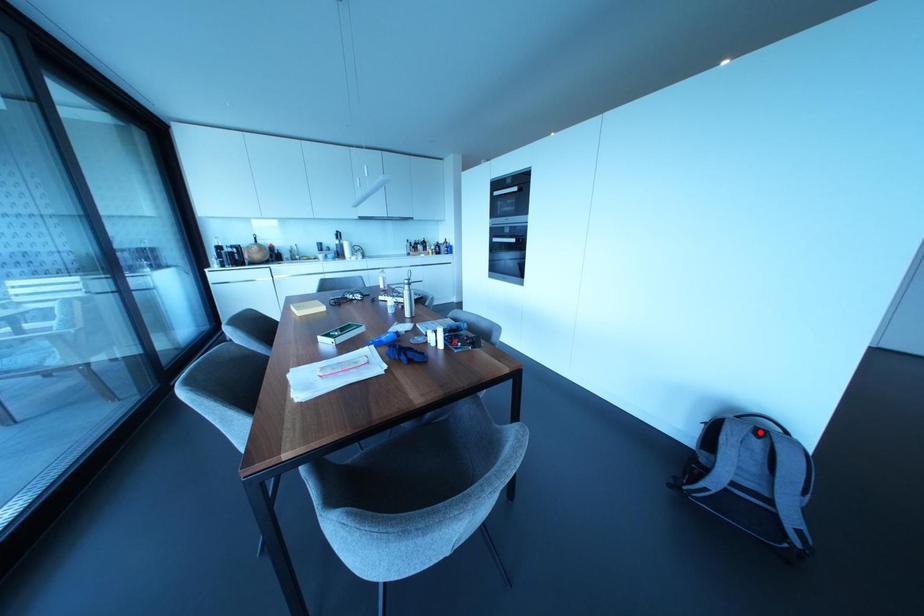
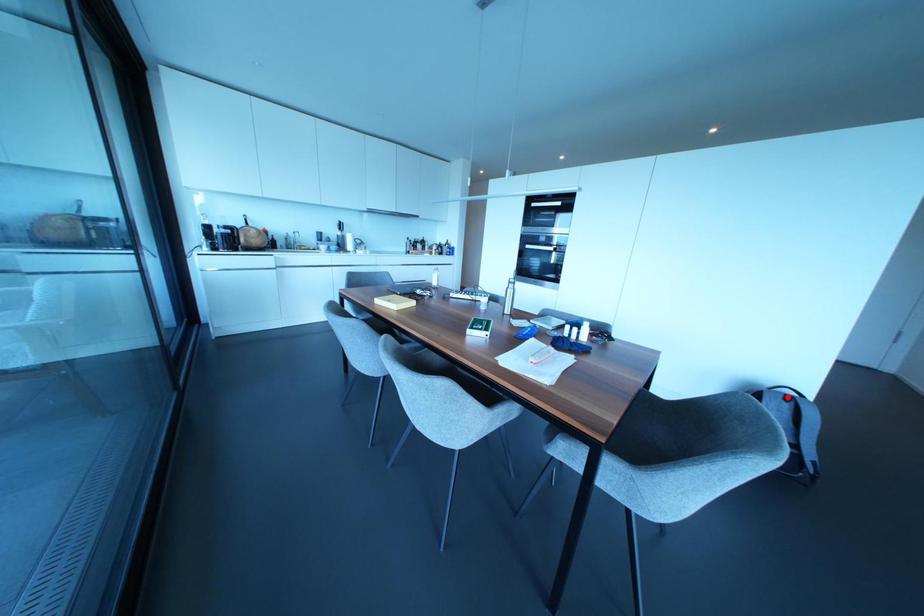
I am providing you with two images of the same scene from different viewpoints. A red point is marked on the first image and another point is marked on the second image. Does the point marked in image1 correspond to the same location as the one in image2?

Yes